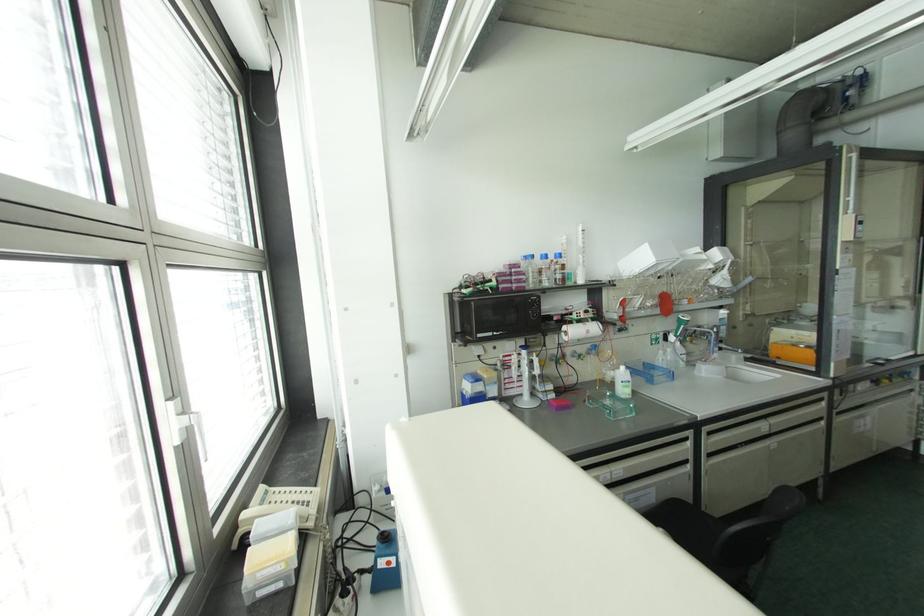
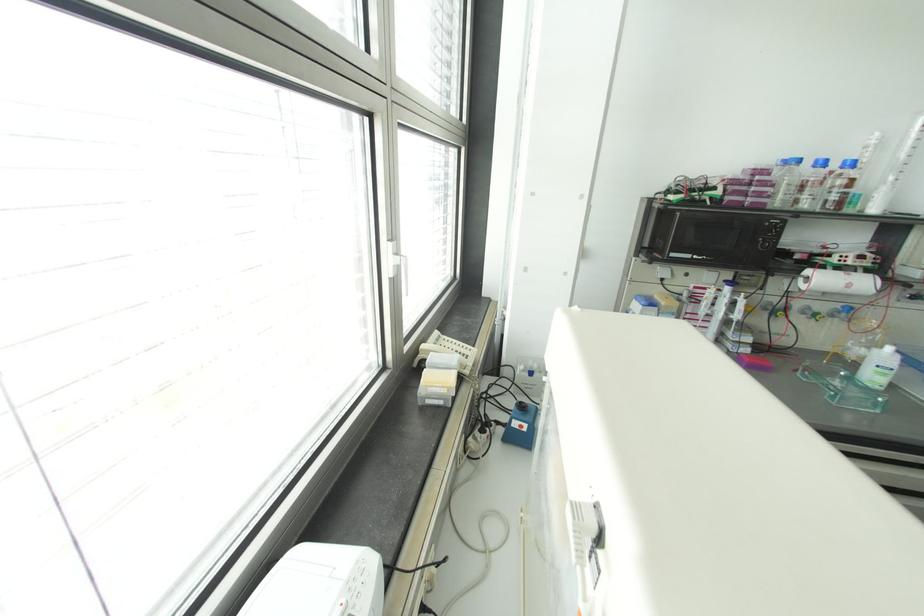
Where in the second image is the point corresponding to pixel 544 256 from the first image?

(822, 163)